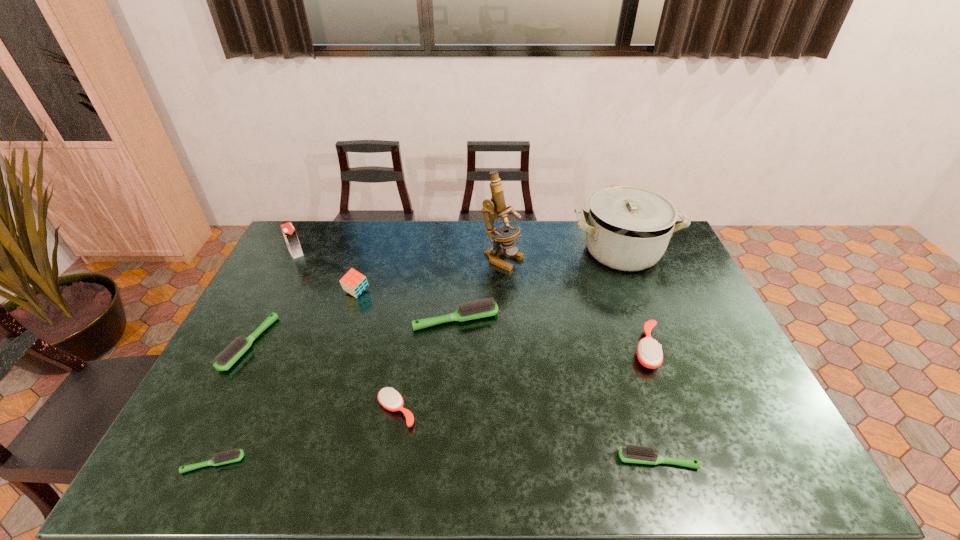
This screenshot has height=540, width=960. I want to click on the third smallest light hairbrush, so click(x=226, y=358).

The width and height of the screenshot is (960, 540). In order to click on the nearer orange hairbrush in this screenshot , I will do `click(389, 398)`.

Where is `the third nearest hairbrush`? The width and height of the screenshot is (960, 540). the third nearest hairbrush is located at coordinates (389, 398).

This screenshot has width=960, height=540. I want to click on the rightmost light hairbrush, so click(632, 454).

Find the location of `the second shortest object`. the second shortest object is located at coordinates click(x=632, y=454).

The width and height of the screenshot is (960, 540). In order to click on the shortest object in this screenshot , I will do `click(229, 456)`.

The height and width of the screenshot is (540, 960). I want to click on the smallest light hairbrush, so click(229, 456).

In order to click on vacant space located 0.060m on the front of the tallest object in this screenshot , I will do `click(504, 284)`.

In order to click on vacant space located on the front of the saucepan in this screenshot , I will do `click(654, 331)`.

The width and height of the screenshot is (960, 540). I want to click on free point located 0.340m on the right of the orange orange juice, so click(x=397, y=253).